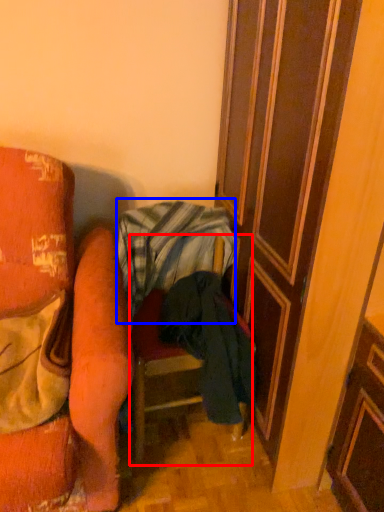
Question: Which object appears farthest to the camera in this image, furniture (highlighted by a red box) or blanket (highlighted by a blue box)?

Choices:
 (A) furniture
 (B) blanket

Answer: (B)